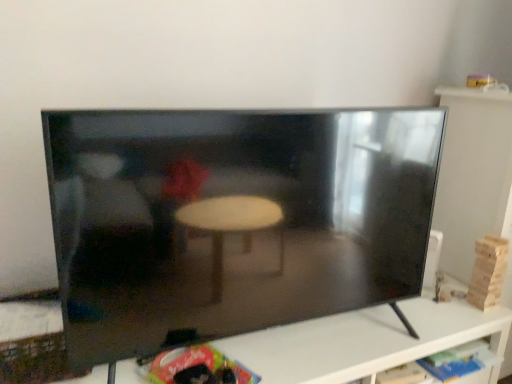
In order to click on vacant region below black glossy tv at center (from a real-world perspective) in this screenshot , I will do `click(308, 338)`.